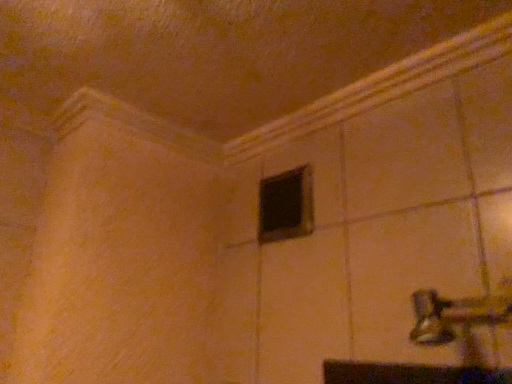
Question: From a real-world perspective, is metallic silver door handle at lower right on black matte window at center?

Choices:
 (A) no
 (B) yes

Answer: (A)

Question: Is metallic silver door handle at lower right oriented away from black matte window at center?

Choices:
 (A) no
 (B) yes

Answer: (A)

Question: From a real-world perspective, is metallic silver door handle at lower right positioned under black matte window at center based on gravity?

Choices:
 (A) yes
 (B) no

Answer: (A)

Question: Does metallic silver door handle at lower right have a lesser height compared to black matte window at center?

Choices:
 (A) no
 (B) yes

Answer: (B)

Question: Considering the relative positions of metallic silver door handle at lower right and black matte window at center in the image provided, is metallic silver door handle at lower right to the left of black matte window at center from the viewer's perspective?

Choices:
 (A) no
 (B) yes

Answer: (A)

Question: Does metallic silver door handle at lower right have a smaller size compared to black matte window at center?

Choices:
 (A) no
 (B) yes

Answer: (A)

Question: Does black matte window at center have a smaller size compared to metallic silver door handle at lower right?

Choices:
 (A) no
 (B) yes

Answer: (B)

Question: Can you confirm if black matte window at center is bigger than metallic silver door handle at lower right?

Choices:
 (A) no
 (B) yes

Answer: (A)

Question: Is black matte window at center thinner than metallic silver door handle at lower right?

Choices:
 (A) no
 (B) yes

Answer: (B)

Question: Is black matte window at center facing towards metallic silver door handle at lower right?

Choices:
 (A) yes
 (B) no

Answer: (B)

Question: Is black matte window at center not close to metallic silver door handle at lower right?

Choices:
 (A) yes
 (B) no

Answer: (B)

Question: Can you confirm if black matte window at center is positioned to the left of metallic silver door handle at lower right?

Choices:
 (A) no
 (B) yes

Answer: (B)

Question: From a real-world perspective, is black matte window at center above or below metallic silver door handle at lower right?

Choices:
 (A) above
 (B) below

Answer: (A)